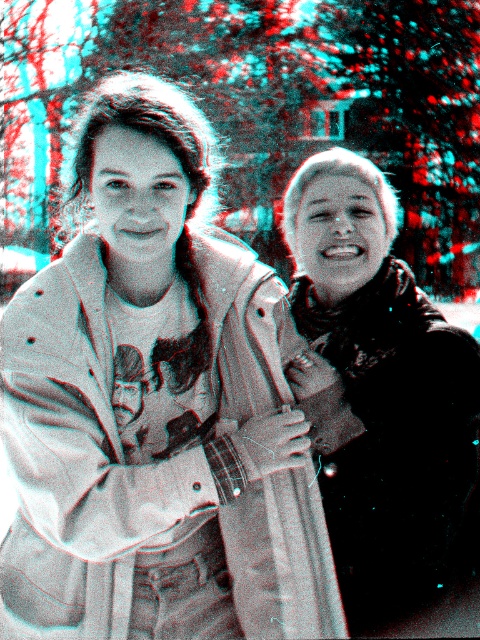
Question: Does light beige textured trench coat at center appear under velvet black scarf at right?

Choices:
 (A) no
 (B) yes

Answer: (B)

Question: Does light beige textured trench coat at center appear on the left side of velvet black scarf at right?

Choices:
 (A) yes
 (B) no

Answer: (A)

Question: Can you confirm if light beige textured trench coat at center is bigger than velvet black scarf at right?

Choices:
 (A) no
 (B) yes

Answer: (B)